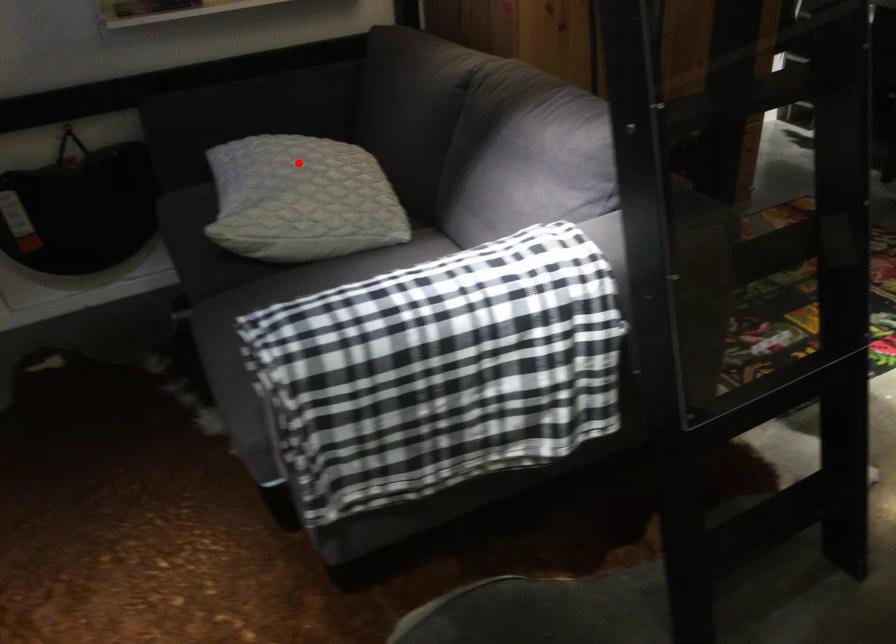
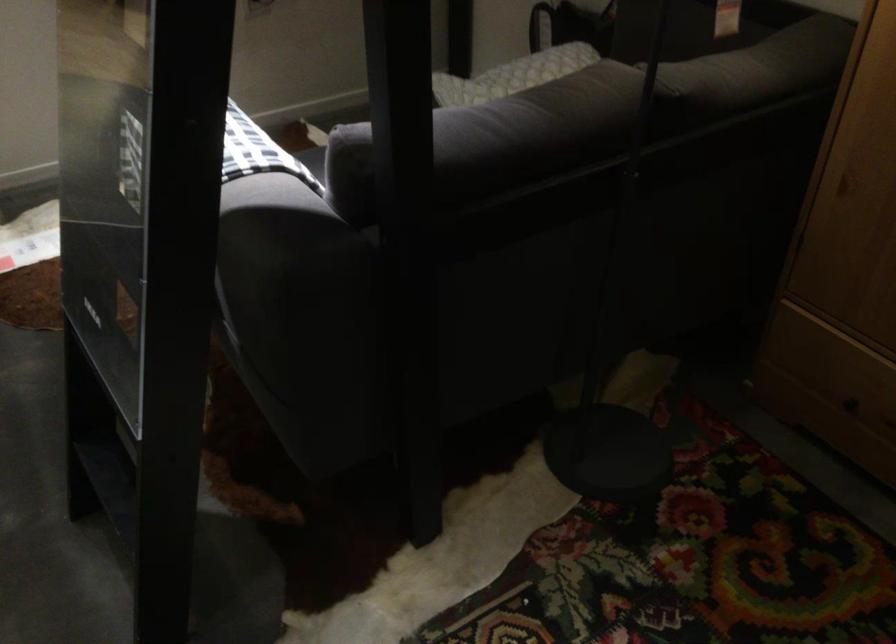
The point at the highlighted location is marked in the first image. Where is the corresponding point in the second image?

(528, 68)